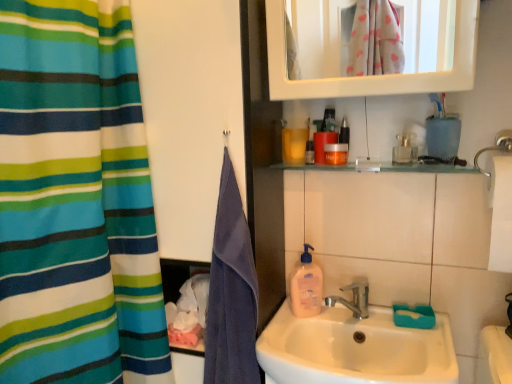
Question: Can you confirm if striped fabric curtain at left is wider than translucent plastic bottle at upper center, the 1th mouthwash when ordered from left to right?

Choices:
 (A) no
 (B) yes

Answer: (B)

Question: Considering the relative sizes of striped fabric curtain at left and translucent plastic bottle at upper center, the 1th mouthwash when ordered from left to right, in the image provided, is striped fabric curtain at left bigger than translucent plastic bottle at upper center, the 1th mouthwash when ordered from left to right,?

Choices:
 (A) no
 (B) yes

Answer: (B)

Question: From a real-world perspective, is striped fabric curtain at left physically above translucent plastic bottle at upper center, the fourth mouthwash from the right?

Choices:
 (A) no
 (B) yes

Answer: (A)

Question: From the image's perspective, would you say striped fabric curtain at left is positioned over translucent plastic bottle at upper center, the fourth mouthwash from the right?

Choices:
 (A) no
 (B) yes

Answer: (A)

Question: Can you confirm if striped fabric curtain at left is shorter than translucent plastic bottle at upper center, the fourth mouthwash from the right?

Choices:
 (A) no
 (B) yes

Answer: (A)

Question: Does point (251, 321) appear closer or farther from the camera than point (314, 380)?

Choices:
 (A) farther
 (B) closer

Answer: (A)

Question: In terms of width, does purple cotton towel at left look wider or thinner when compared to white ceramic sink at center?

Choices:
 (A) wide
 (B) thin

Answer: (B)

Question: Would you say purple cotton towel at left is to the left or to the right of white ceramic sink at center in the picture?

Choices:
 (A) left
 (B) right

Answer: (A)

Question: Is purple cotton towel at left inside or outside of white ceramic sink at center?

Choices:
 (A) outside
 (B) inside

Answer: (A)

Question: From the image's perspective, is orange matte bottle at upper center, arranged as the third mouthwash when viewed from the left, above or below teal plastic toothbrush holder at upper right?

Choices:
 (A) above
 (B) below

Answer: (B)

Question: In the image, is orange matte bottle at upper center, arranged as the third mouthwash when viewed from the left, on the left side or the right side of teal plastic toothbrush holder at upper right?

Choices:
 (A) right
 (B) left

Answer: (B)

Question: In terms of width, does orange matte bottle at upper center, arranged as the third mouthwash when viewed from the left, look wider or thinner when compared to teal plastic toothbrush holder at upper right?

Choices:
 (A) wide
 (B) thin

Answer: (B)

Question: Is orange matte bottle at upper center, arranged as the third mouthwash when viewed from the left, situated inside teal plastic toothbrush holder at upper right or outside?

Choices:
 (A) inside
 (B) outside

Answer: (B)

Question: Based on their sizes in the image, would you say translucent plastic bottle at upper center, the 1th mouthwash when ordered from left to right, is bigger or smaller than translucent plastic soap dispenser at sink?

Choices:
 (A) small
 (B) big

Answer: (A)

Question: Does point (313, 160) appear closer or farther from the camera than point (312, 284)?

Choices:
 (A) closer
 (B) farther

Answer: (A)